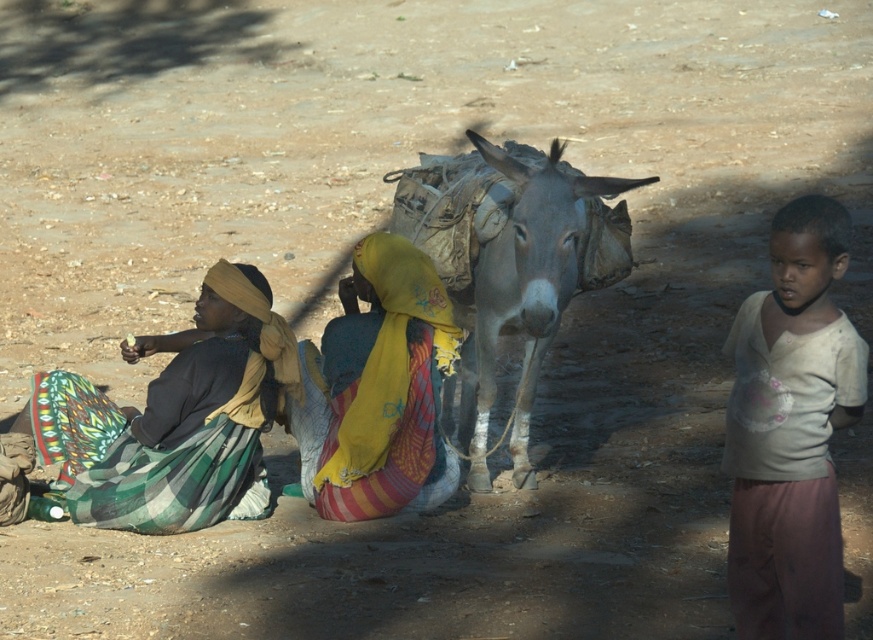
You are standing at the center of the image and want to walk to the light beige cotton shirt at right. Which direction should you move towards?

You should move towards the right side of the image to reach the light beige cotton shirt at right since its position is at point (791, 429), which is on the right side.

In the rural scene, there are a gray textured donkey at center and a yellow fabric headscarf at center. Which object is positioned higher from the ground?

The gray textured donkey at center is positioned higher from the ground than the yellow fabric headscarf at center.

You are a photographer trying to capture a photo of the light beige cotton shirt at right and the matte yellow headscarf at left. If you want to ensure both are in focus, which one should you focus on first considering their heights?

The light beige cotton shirt at right is taller than the matte yellow headscarf at left. To ensure both are in focus, you should focus on the light beige cotton shirt at right first as it is taller and likely farther away.